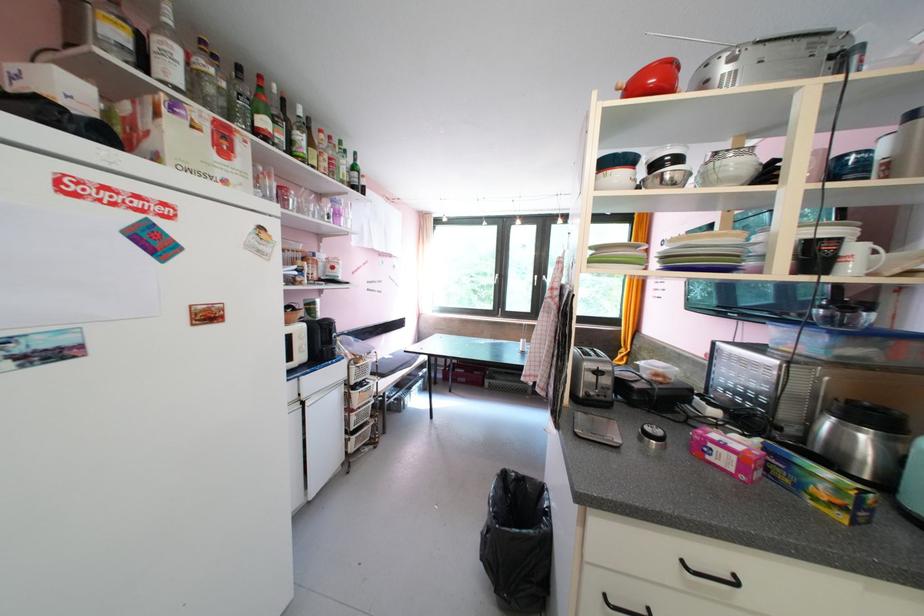
You are a GUI agent. You are given a task and a screenshot of the screen. Output one action in this format:
    pyautogui.click(x=<x>, y=<y>)
    Task: Click on the pink cardboard box
    
    Given the screenshot: What is the action you would take?
    pyautogui.click(x=726, y=454)